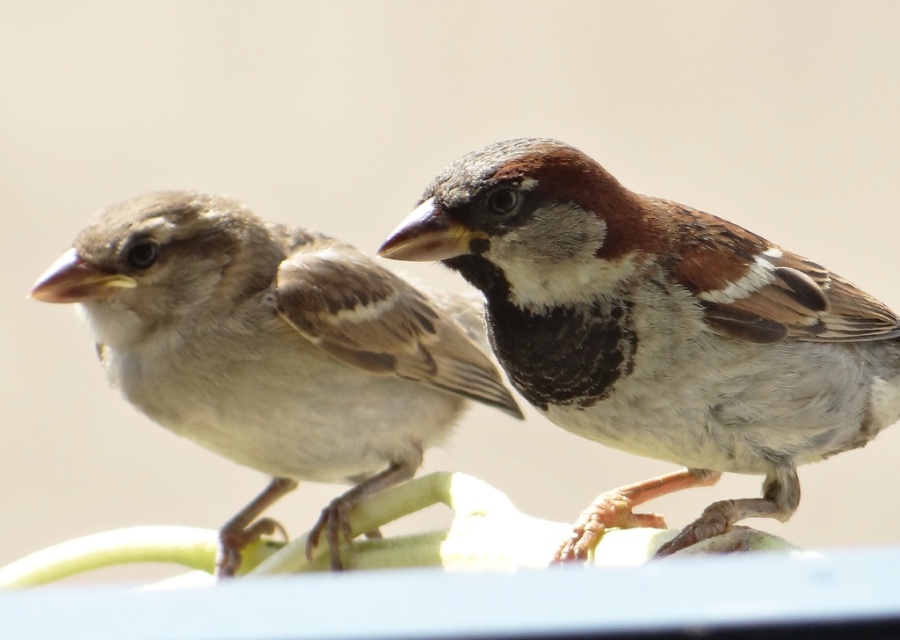
Question: Which point is closer to the camera taking this photo?

Choices:
 (A) (446, 416)
 (B) (869, 326)

Answer: (B)

Question: Which point is farther to the camera?

Choices:
 (A) brown feathered sparrow at left
 (B) brown speckled feathers at center

Answer: (A)

Question: Is brown speckled feathers at center positioned in front of brown feathered sparrow at left?

Choices:
 (A) yes
 (B) no

Answer: (A)

Question: Does brown speckled feathers at center appear on the right side of brown feathered sparrow at left?

Choices:
 (A) no
 (B) yes

Answer: (B)

Question: Where is brown speckled feathers at center located in relation to brown feathered sparrow at left in the image?

Choices:
 (A) left
 (B) right

Answer: (B)

Question: Which point is closer to the camera taking this photo?

Choices:
 (A) (191, 300)
 (B) (834, 362)

Answer: (B)